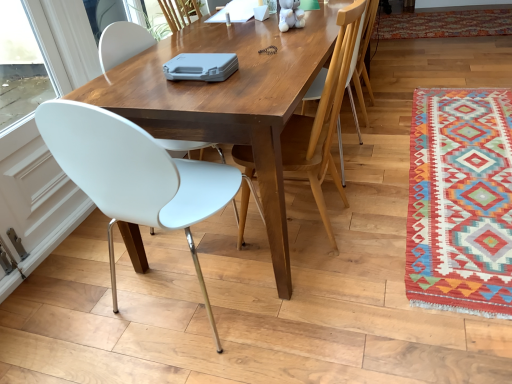
Identify the location of vacant area located to the right-hand side of wooden chair at upper right, the 3th chair in the left-to-right sequence. The image size is (512, 384). (396, 97).